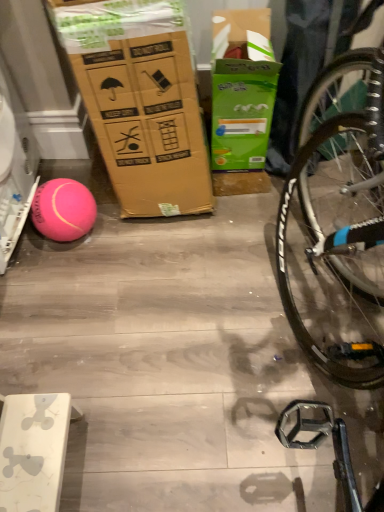
What do you see at coordinates (242, 113) in the screenshot? Image resolution: width=384 pixels, height=512 pixels. I see `green cardboard box at upper center` at bounding box center [242, 113].

At what (x,y) coordinates should I click in order to perform the action: click on green cardboard box at upper center. Please return your answer as a coordinate pair (x, y). Looking at the image, I should click on (242, 113).

Locate an element on the screen. pink rubber ball at left is located at coordinates (63, 210).

What do you see at coordinates (63, 210) in the screenshot? This screenshot has width=384, height=512. I see `pink rubber ball at left` at bounding box center [63, 210].

Measure the distance between point (61, 180) and camera.

The depth of point (61, 180) is 1.46 meters.

From the picture: What is the approximate width of pink rubber ball at left?

7.05 inches.

Find the location of a particular element. This screenshot has width=384, height=512. green cardboard box at upper center is located at coordinates (242, 113).

In the image, is pink rubber ball at left on the left side or the right side of green cardboard box at upper center?

pink rubber ball at left is to the left of green cardboard box at upper center.

Relative to green cardboard box at upper center, is pink rubber ball at left in front or behind?

Visually, pink rubber ball at left is located behind green cardboard box at upper center.

Which is closer to the camera, (74, 202) or (228, 117)?

Point (74, 202)

From the image's perspective, which is above, pink rubber ball at left or green cardboard box at upper center?

green cardboard box at upper center is shown above in the image.

From a real-world perspective, which is physically above, pink rubber ball at left or green cardboard box at upper center?

green cardboard box at upper center, from a real-world perspective.

Is pink rubber ball at left wider than green cardboard box at upper center?

In fact, pink rubber ball at left might be narrower than green cardboard box at upper center.

Based on the photo, between pink rubber ball at left and green cardboard box at upper center, which one has more height?

With more height is green cardboard box at upper center.

Is pink rubber ball at left bigger or smaller than green cardboard box at upper center?

In the image, pink rubber ball at left appears to be smaller than green cardboard box at upper center.

Is pink rubber ball at left not within green cardboard box at upper center?

Yes.

Looking at this image, is pink rubber ball at left not near green cardboard box at upper center?

They are positioned close to each other.

Is pink rubber ball at left facing towards green cardboard box at upper center?

No, pink rubber ball at left is not oriented towards green cardboard box at upper center.

How much distance is there between pink rubber ball at left and green cardboard box at upper center?

23.60 inches.

What are the coordinates of `cardboard box above the pink rubber ball at left (from the image's perspective)` in the screenshot? It's located at (242, 113).

Does green cardboard box at upper center appear on the left side of pink rubber ball at left?

In fact, green cardboard box at upper center is to the right of pink rubber ball at left.

Between green cardboard box at upper center and pink rubber ball at left, which one is positioned in front?

green cardboard box at upper center is more forward.

Does point (263, 146) lie behind point (58, 229)?

Yes, it is behind point (58, 229).

From the image's perspective, who appears lower, green cardboard box at upper center or pink rubber ball at left?

pink rubber ball at left is shown below in the image.

From a real-world perspective, is green cardboard box at upper center on top of pink rubber ball at left?

Yes.

Considering the sizes of objects green cardboard box at upper center and pink rubber ball at left in the image provided, who is thinner, green cardboard box at upper center or pink rubber ball at left?

Thinner between the two is pink rubber ball at left.

Consider the image. Who is shorter, green cardboard box at upper center or pink rubber ball at left?

With less height is pink rubber ball at left.

Who is bigger, green cardboard box at upper center or pink rubber ball at left?

green cardboard box at upper center.

Can we say green cardboard box at upper center lies outside pink rubber ball at left?

Indeed, green cardboard box at upper center is completely outside pink rubber ball at left.

Can you see green cardboard box at upper center touching pink rubber ball at left?

There is a gap between green cardboard box at upper center and pink rubber ball at left.

Is green cardboard box at upper center positioned with its back to pink rubber ball at left?

No, green cardboard box at upper center's orientation is not away from pink rubber ball at left.

How different are the orientations of green cardboard box at upper center and pink rubber ball at left in degrees?

There is a 2.24-degree angle between the facing directions of green cardboard box at upper center and pink rubber ball at left.

What are the coordinates of `ball that appears on the left of green cardboard box at upper center` in the screenshot? It's located at (63, 210).

Where is `ball located underneath the green cardboard box at upper center (from a real-world perspective)`? The height and width of the screenshot is (512, 384). ball located underneath the green cardboard box at upper center (from a real-world perspective) is located at coordinates (63, 210).

This screenshot has height=512, width=384. Identify the location of ball located behind the green cardboard box at upper center. (63, 210).